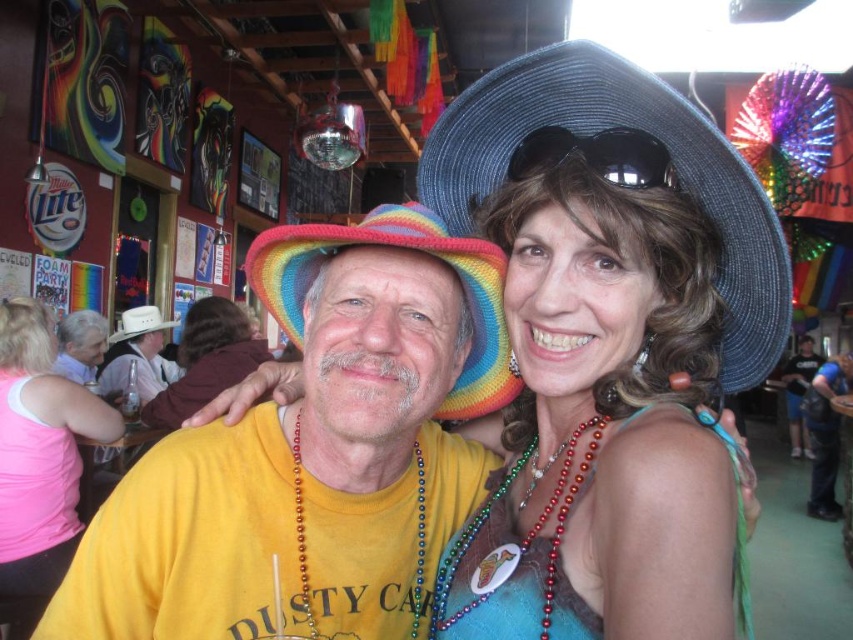
Can you confirm if blue straw hat at upper right is positioned above white leather cowboy hat at left?

Correct, blue straw hat at upper right is located above white leather cowboy hat at left.

Is blue straw hat at upper right bigger than white leather cowboy hat at left?

Incorrect, blue straw hat at upper right is not larger than white leather cowboy hat at left.

Where is `blue straw hat at upper right`? The width and height of the screenshot is (853, 640). blue straw hat at upper right is located at coordinates (612, 125).

Locate an element on the screen. This screenshot has height=640, width=853. blue straw hat at upper right is located at coordinates (612, 125).

Which is more to the left, yellow cotton shirt at center or red beaded necklace at center?

Positioned to the left is yellow cotton shirt at center.

Is yellow cotton shirt at center shorter than red beaded necklace at center?

In fact, yellow cotton shirt at center may be taller than red beaded necklace at center.

Who is more forward, (316,243) or (556,560)?

Point (556,560)

In order to click on yellow cotton shirt at center in this screenshot , I will do `click(312, 451)`.

Does point (637, 170) lie in front of point (39, 400)?

Yes.

Between point (498, 570) and point (71, 413), which one is positioned in front?

Positioned in front is point (498, 570).

Where is `shiny blue dress at center`? The image size is (853, 640). shiny blue dress at center is located at coordinates (602, 412).